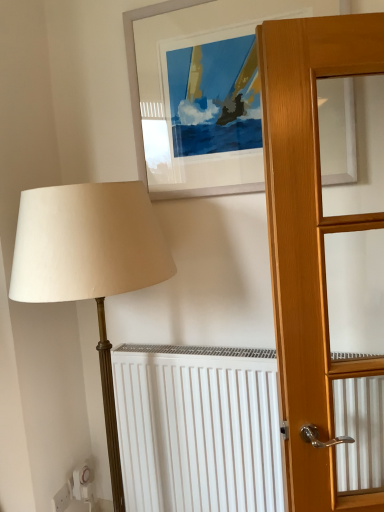
Describe the element at coordinates (198, 103) in the screenshot. I see `white matte picture frame at upper center` at that location.

Where is `white matte picture frame at upper center`? The height and width of the screenshot is (512, 384). white matte picture frame at upper center is located at coordinates (198, 103).

What do you see at coordinates (61, 499) in the screenshot? This screenshot has height=512, width=384. I see `white plastic electric outlet at lower left` at bounding box center [61, 499].

Identify the location of white plastic electric outlet at lower left. Image resolution: width=384 pixels, height=512 pixels. (61, 499).

In order to click on white matte picture frame at upper center in this screenshot , I will do `click(198, 103)`.

Between white plastic electric outlet at lower left and white matte picture frame at upper center, which one appears on the left side from the viewer's perspective?

white plastic electric outlet at lower left.

Is white plastic electric outlet at lower left in front of or behind white matte picture frame at upper center in the image?

Clearly, white plastic electric outlet at lower left is behind white matte picture frame at upper center.

Is point (55, 500) farther from viewer compared to point (251, 134)?

Yes, it is.

From the image's perspective, is white plastic electric outlet at lower left located above white matte picture frame at upper center?

No, from the image's perspective, white plastic electric outlet at lower left is not on top of white matte picture frame at upper center.

From a real-world perspective, which is physically above, white plastic electric outlet at lower left or white matte picture frame at upper center?

white matte picture frame at upper center, from a real-world perspective.

Considering the sizes of objects white plastic electric outlet at lower left and white matte picture frame at upper center in the image provided, who is wider, white plastic electric outlet at lower left or white matte picture frame at upper center?

white matte picture frame at upper center is wider.

Considering the relative sizes of white plastic electric outlet at lower left and white matte picture frame at upper center in the image provided, is white plastic electric outlet at lower left taller than white matte picture frame at upper center?

Incorrect, the height of white plastic electric outlet at lower left is not larger of that of white matte picture frame at upper center.

Between white plastic electric outlet at lower left and white matte picture frame at upper center, which one has smaller size?

Smaller between the two is white plastic electric outlet at lower left.

Would you say white plastic electric outlet at lower left is outside white matte picture frame at upper center?

That's correct, white plastic electric outlet at lower left is outside of white matte picture frame at upper center.

Would you say white plastic electric outlet at lower left is a long distance from white matte picture frame at upper center?

white plastic electric outlet at lower left is far away from white matte picture frame at upper center.

Is white plastic electric outlet at lower left oriented away from white matte picture frame at upper center?

No.

How many degrees apart are the facing directions of white plastic electric outlet at lower left and white matte picture frame at upper center?

The facing directions of white plastic electric outlet at lower left and white matte picture frame at upper center are 95 degrees apart.

How distant is white plastic electric outlet at lower left from white matte picture frame at upper center?

The distance of white plastic electric outlet at lower left from white matte picture frame at upper center is 4.87 feet.

What are the coordinates of `electric outlet located behind the white matte picture frame at upper center` in the screenshot? It's located at (61, 499).

Based on their positions, is white matte picture frame at upper center located to the left or right of white plastic electric outlet at lower left?

Based on their positions, white matte picture frame at upper center is located to the right of white plastic electric outlet at lower left.

Is white matte picture frame at upper center in front of or behind white plastic electric outlet at lower left in the image?

Clearly, white matte picture frame at upper center is in front of white plastic electric outlet at lower left.

Which is closer to the camera, (147,144) or (61,493)?

Point (147,144) is positioned closer to the camera compared to point (61,493).

From the image's perspective, is white matte picture frame at upper center located above or below white plastic electric outlet at lower left?

white matte picture frame at upper center is above white plastic electric outlet at lower left.

From a real-world perspective, which object rests below the other?

white plastic electric outlet at lower left is physically lower.

Which of these two, white matte picture frame at upper center or white plastic electric outlet at lower left, is wider?

white matte picture frame at upper center is wider.

Is white matte picture frame at upper center taller than white plastic electric outlet at lower left?

Correct, white matte picture frame at upper center is much taller as white plastic electric outlet at lower left.

From the picture: Based on their sizes in the image, would you say white matte picture frame at upper center is bigger or smaller than white plastic electric outlet at lower left?

white matte picture frame at upper center is bigger than white plastic electric outlet at lower left.

Is white matte picture frame at upper center positioned beyond the bounds of white plastic electric outlet at lower left?

That's correct, white matte picture frame at upper center is outside of white plastic electric outlet at lower left.

Is white matte picture frame at upper center directly adjacent to white plastic electric outlet at lower left?

No, white matte picture frame at upper center is not in contact with white plastic electric outlet at lower left.

Is white matte picture frame at upper center positioned with its back to white plastic electric outlet at lower left?

No, white plastic electric outlet at lower left is not at the back of white matte picture frame at upper center.

You are a GUI agent. You are given a task and a screenshot of the screen. Output one action in this format:
    pyautogui.click(x=<x>, y=<y>)
    Task: Click on the electric outlet behind the white matte picture frame at upper center
    The height and width of the screenshot is (512, 384).
    Given the screenshot: What is the action you would take?
    pyautogui.click(x=61, y=499)

Locate an element on the screen. This screenshot has height=512, width=384. picture frame positioned vertically above the white plastic electric outlet at lower left (from a real-world perspective) is located at coordinates (198, 103).

The width and height of the screenshot is (384, 512). Identify the location of picture frame located above the white plastic electric outlet at lower left (from the image's perspective). (198, 103).